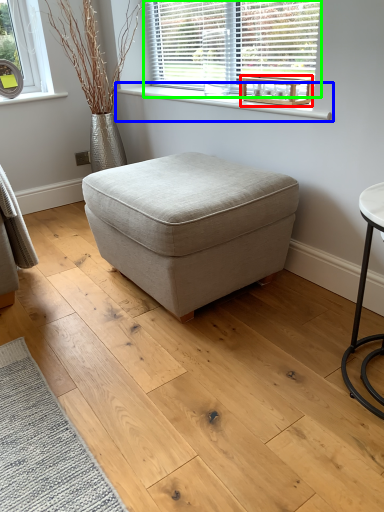
Question: Which object is the farthest from round table (highlighted by a red box)? Choose among these: window sill (highlighted by a blue box) or window (highlighted by a green box).

Choices:
 (A) window sill
 (B) window

Answer: (B)